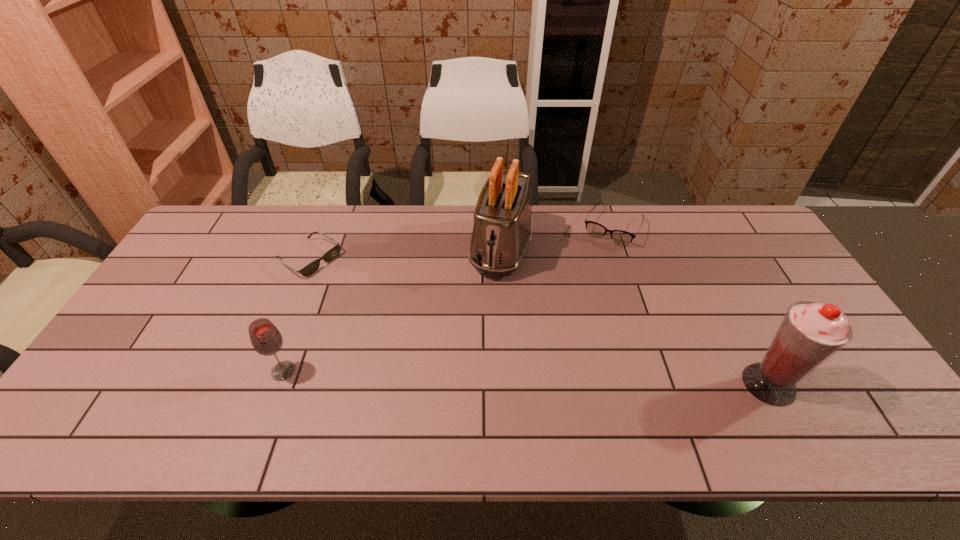
This screenshot has width=960, height=540. I want to click on free space located on the side of the third object from right to left with the control lever, so click(x=470, y=355).

At what (x,y) coordinates should I click in order to perform the action: click on vacant space located 0.070m on the face of the second object from right to left. Please return your answer as a coordinate pair (x, y). The height and width of the screenshot is (540, 960). Looking at the image, I should click on (596, 260).

Identify the location of free space located 0.210m on the face of the second object from right to left. Image resolution: width=960 pixels, height=540 pixels. (582, 288).

This screenshot has height=540, width=960. Identify the location of vacant space situated on the face of the second object from right to left. (589, 273).

Where is `free space located 0.240m on the front-facing side of the shortest object`? The image size is (960, 540). free space located 0.240m on the front-facing side of the shortest object is located at coordinates (386, 306).

Find the location of a particular element. The width and height of the screenshot is (960, 540). vacant space located on the front-facing side of the shortest object is located at coordinates click(x=364, y=293).

What are the coordinates of `vacant region located on the front-facing side of the shortest object` in the screenshot? It's located at (426, 330).

Where is `toaster that is at the far edge`? The width and height of the screenshot is (960, 540). toaster that is at the far edge is located at coordinates (502, 228).

The image size is (960, 540). Find the location of `spectacles that is positioned at the far edge`. spectacles that is positioned at the far edge is located at coordinates (594, 229).

You are a GUI agent. You are given a task and a screenshot of the screen. Output one action in this format:
    pyautogui.click(x=<x>, y=<y>)
    Task: Click on the sunglasses that is positioned at the far edge
    
    Given the screenshot: What is the action you would take?
    pyautogui.click(x=333, y=252)